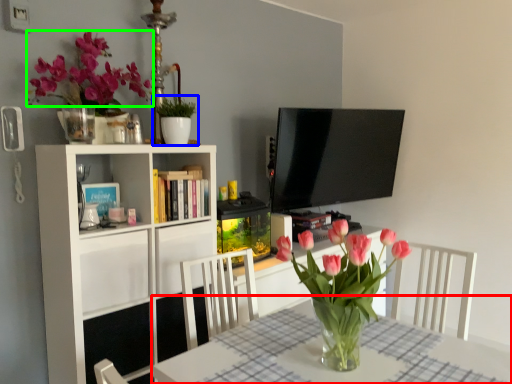
Question: Based on their relative distances, which object is farther from table (highlighted by a red box)? Choose from houseplant (highlighted by a blue box) and flower (highlighted by a green box).

Choices:
 (A) houseplant
 (B) flower

Answer: (B)